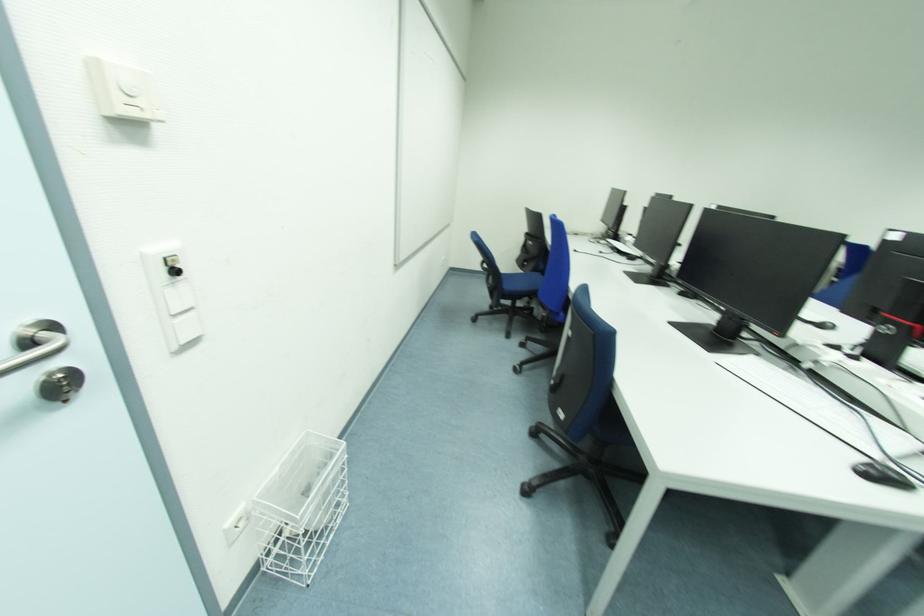
This screenshot has height=616, width=924. What do you see at coordinates (128, 84) in the screenshot?
I see `the white thermostat dial` at bounding box center [128, 84].